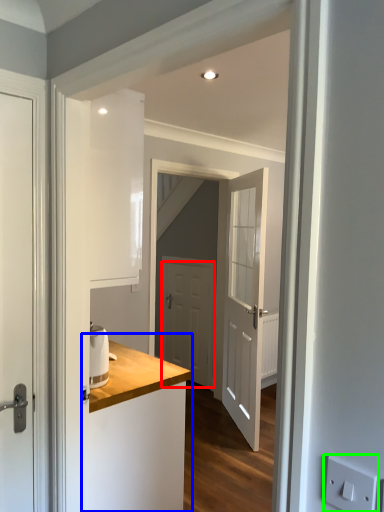
Question: Considering the real-world distances, which object is farthest from door (highlighted by a red box)? counter (highlighted by a blue box) or electric outlet (highlighted by a green box)?

Choices:
 (A) counter
 (B) electric outlet

Answer: (B)